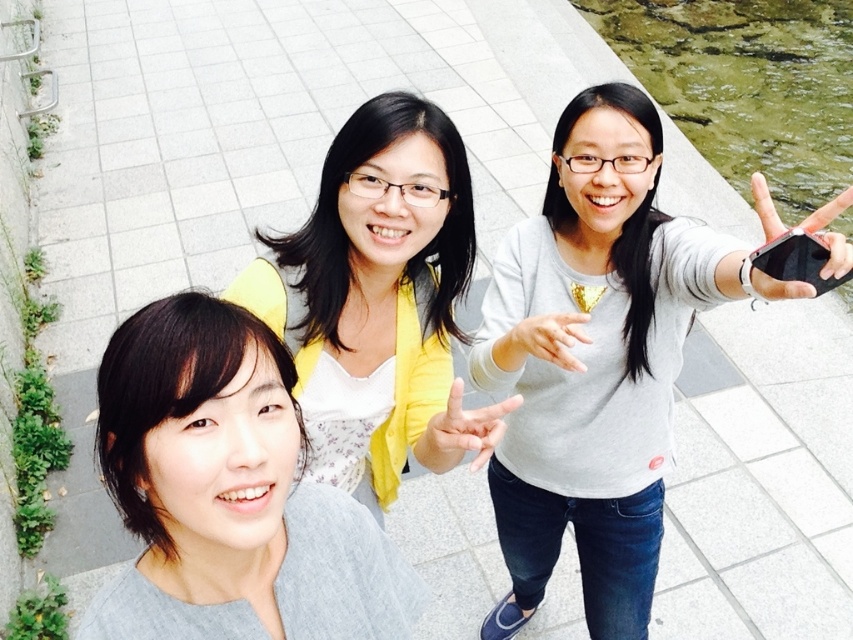
What do you see at coordinates (598, 362) in the screenshot?
I see `gray matte shirt at center` at bounding box center [598, 362].

Is gray matte shirt at center shorter than black matte phone at upper right?

No.

Where is `gray matte shirt at center`? gray matte shirt at center is located at coordinates (598, 362).

Which is behind, point (467, 419) or point (521, 328)?

Point (521, 328)

Between point (427, 467) and point (492, 353), which one is positioned behind?

Point (492, 353)

Find the location of a particular element. matte yellow hand at center is located at coordinates (461, 433).

Does matte yellow cardigan at center have a greater width compared to clear glass water at upper right?

In fact, matte yellow cardigan at center might be narrower than clear glass water at upper right.

Does matte yellow cardigan at center lie behind clear glass water at upper right?

That is False.

Where is `matte yellow cardigan at center`? matte yellow cardigan at center is located at coordinates (378, 301).

Locate an element on the screen. matte yellow cardigan at center is located at coordinates (378, 301).